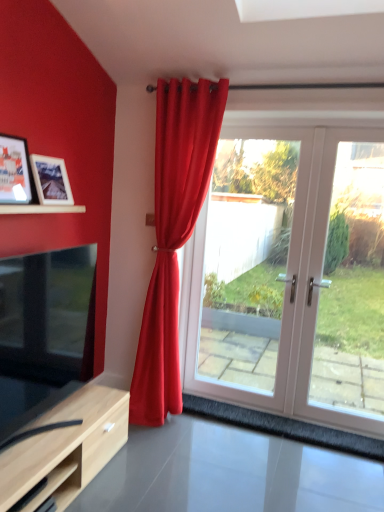
Question: Considering the relative positions of matte wooden picture frame at upper left, the 2th picture frame in the front-to-back sequence, and wooden picture frame at left, which ranks as the first picture frame in front-to-back order, in the image provided, is matte wooden picture frame at upper left, the 2th picture frame in the front-to-back sequence, to the right of wooden picture frame at left, which ranks as the first picture frame in front-to-back order, from the viewer's perspective?

Choices:
 (A) no
 (B) yes

Answer: (B)

Question: Does matte wooden picture frame at upper left, the 1th picture frame when ordered from back to front, appear on the left side of wooden picture frame at left, which ranks as the first picture frame in front-to-back order?

Choices:
 (A) yes
 (B) no

Answer: (B)

Question: Are matte wooden picture frame at upper left, the 2th picture frame in the front-to-back sequence, and wooden picture frame at left, which ranks as the first picture frame in front-to-back order, located far from each other?

Choices:
 (A) yes
 (B) no

Answer: (B)

Question: Is matte wooden picture frame at upper left, the 1th picture frame when ordered from back to front, facing away from wooden picture frame at left, which appears as the second picture frame when viewed from the back?

Choices:
 (A) no
 (B) yes

Answer: (A)

Question: Is wooden picture frame at left, which ranks as the first picture frame in front-to-back order, inside matte wooden picture frame at upper left, the 1th picture frame when ordered from back to front?

Choices:
 (A) yes
 (B) no

Answer: (B)

Question: Is point (246, 237) positioned closer to the camera than point (23, 161)?

Choices:
 (A) farther
 (B) closer

Answer: (A)

Question: From the image's perspective, is white glossy door at center above or below wooden picture frame at left, which appears as the second picture frame when viewed from the back?

Choices:
 (A) above
 (B) below

Answer: (B)

Question: In the image, is white glossy door at center positioned in front of or behind wooden picture frame at left, which ranks as the first picture frame in front-to-back order?

Choices:
 (A) behind
 (B) front

Answer: (A)

Question: Considering the relative positions of white glossy door at center and wooden picture frame at left, which ranks as the first picture frame in front-to-back order, in the image provided, is white glossy door at center to the left or to the right of wooden picture frame at left, which ranks as the first picture frame in front-to-back order,?

Choices:
 (A) left
 (B) right

Answer: (B)

Question: Considering the positions of point (312, 373) and point (158, 293), is point (312, 373) closer or farther from the camera than point (158, 293)?

Choices:
 (A) closer
 (B) farther

Answer: (B)

Question: Would you say white glossy door at center is to the left or to the right of matte red curtain at center in the picture?

Choices:
 (A) right
 (B) left

Answer: (A)

Question: From the image's perspective, is white glossy door at center positioned above or below matte red curtain at center?

Choices:
 (A) below
 (B) above

Answer: (A)

Question: Is white glossy door at center bigger or smaller than matte red curtain at center?

Choices:
 (A) small
 (B) big

Answer: (B)

Question: In the image, is white glossy glass door at right on the left side or the right side of wooden shelf at lower left?

Choices:
 (A) right
 (B) left

Answer: (A)

Question: Is white glossy glass door at right wider or thinner than wooden shelf at lower left?

Choices:
 (A) thin
 (B) wide

Answer: (A)